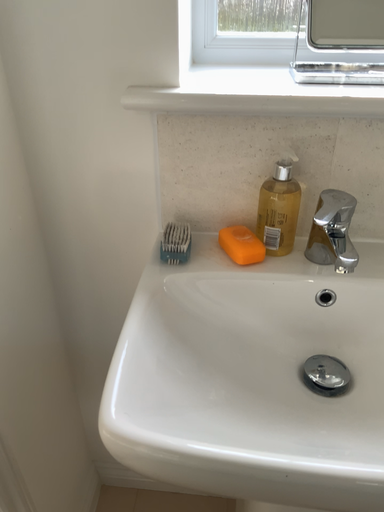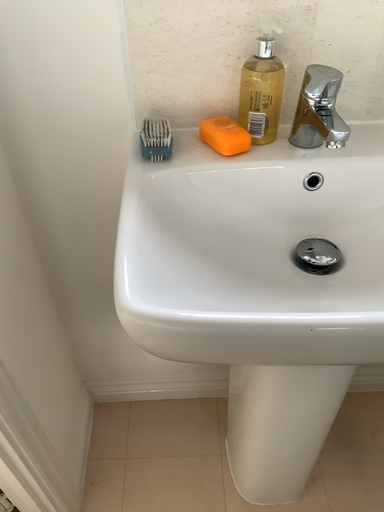
Question: How did the camera likely rotate when shooting the video?

Choices:
 (A) rotated upward
 (B) rotated downward

Answer: (B)